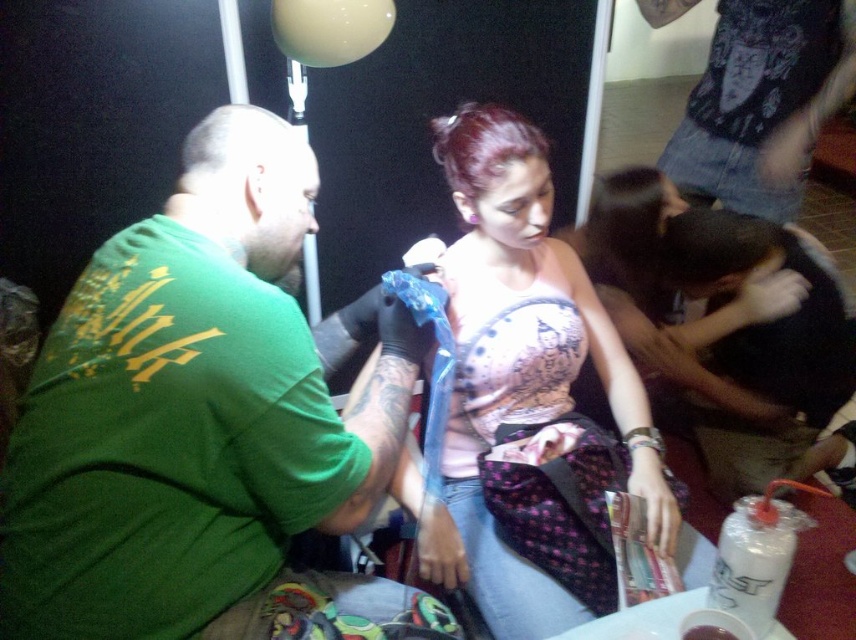
Does green matte shirt at left have a lesser width compared to denim jeans at upper right?

No.

Does green matte shirt at left have a smaller size compared to denim jeans at upper right?

Actually, green matte shirt at left might be larger than denim jeans at upper right.

Who is more distant from viewer, (343, 522) or (788, 29)?

The point (788, 29) is behind.

At what (x,y) coordinates should I click in order to perform the action: click on green matte shirt at left. Please return your answer as a coordinate pair (x, y). Looking at the image, I should click on (204, 422).

Can you confirm if green matte shirt at left is taller than matte pink tank top at center?

No.

Who is shorter, green matte shirt at left or matte pink tank top at center?

With less height is green matte shirt at left.

Find the location of `green matte shirt at left`. green matte shirt at left is located at coordinates (204, 422).

The image size is (856, 640). Identify the location of green matte shirt at left. (204, 422).

Which is above, matte pink tank top at center or denim jeans at upper right?

denim jeans at upper right is above.

Who is positioned more to the left, matte pink tank top at center or denim jeans at upper right?

Positioned to the left is matte pink tank top at center.

Is point (551, 317) less distant than point (700, 164)?

Yes, point (551, 317) is in front of point (700, 164).

Image resolution: width=856 pixels, height=640 pixels. Identify the location of matte pink tank top at center. (532, 394).